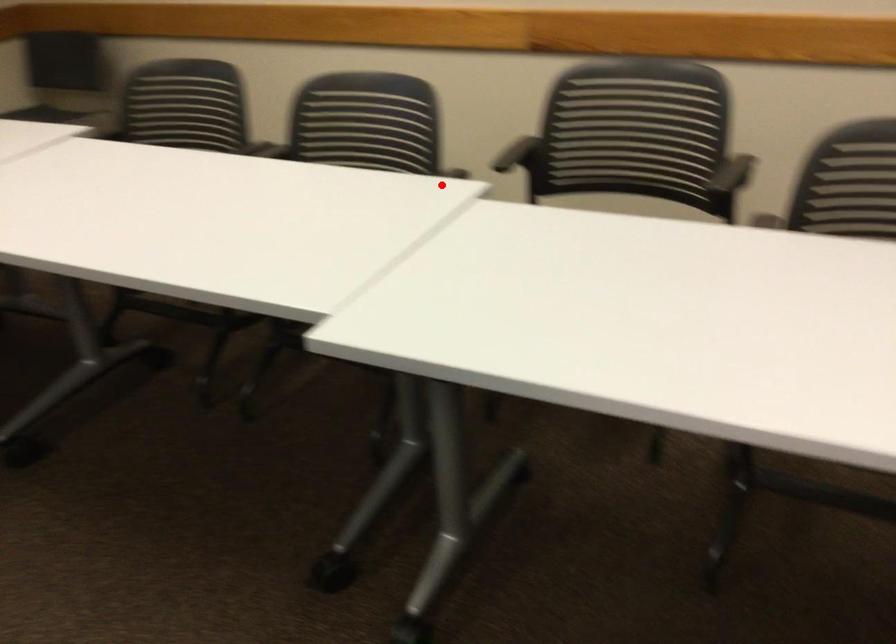
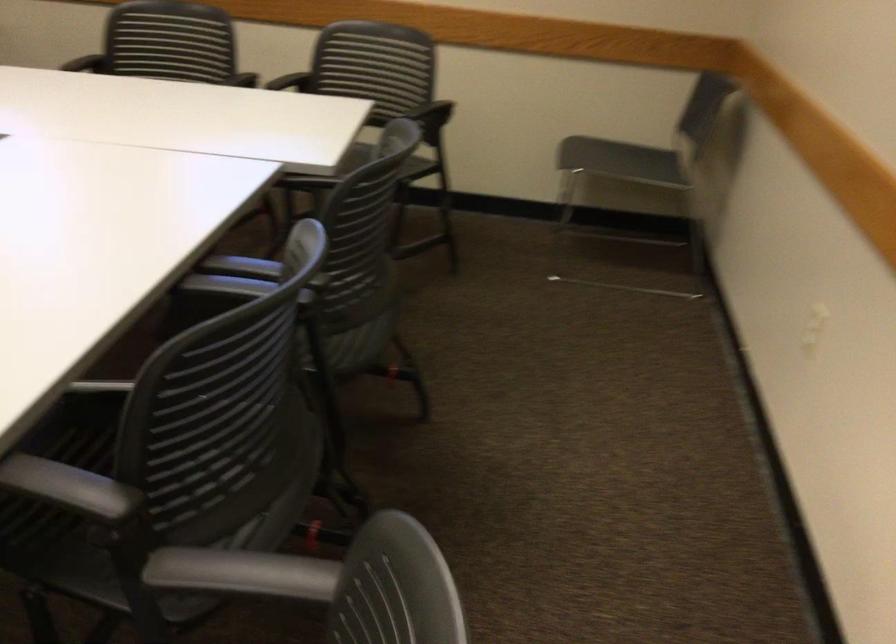
Question: I am providing you with two images of the same scene from different viewpoints. Given a red point in image1, look at the same physical point in image2. Is it:

Choices:
 (A) Closer to the viewpoint
 (B) Farther from the viewpoint

Answer: (A)